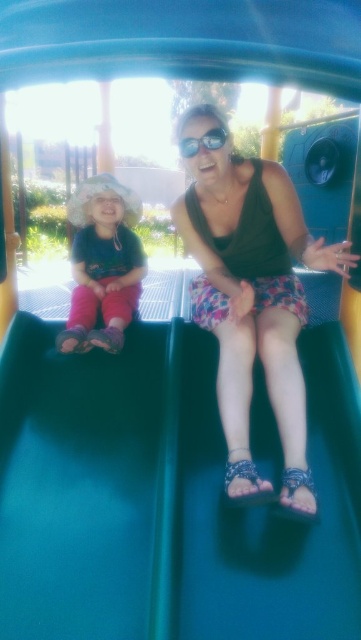
Question: Based on their relative distances, which object is farther from the matte brown tank top at center?

Choices:
 (A) shiny black goggles at center
 (B) green smooth slide at center

Answer: (A)

Question: Does green smooth slide at center appear on the left side of matte pink pants at left?

Choices:
 (A) yes
 (B) no

Answer: (B)

Question: Can you confirm if matte brown tank top at center is positioned below matte pink pants at left?

Choices:
 (A) yes
 (B) no

Answer: (A)

Question: Which point is closer to the camera?

Choices:
 (A) (254, 403)
 (B) (101, 330)
 (C) (297, 502)
 (D) (196, 150)

Answer: (C)

Question: Is matte brown tank top at center thinner than shiny black goggles at center?

Choices:
 (A) yes
 (B) no

Answer: (B)

Question: Which of the following is the farthest from the observer?

Choices:
 (A) (123, 266)
 (B) (186, 140)
 (C) (355, 515)
 (D) (194, 186)

Answer: (A)